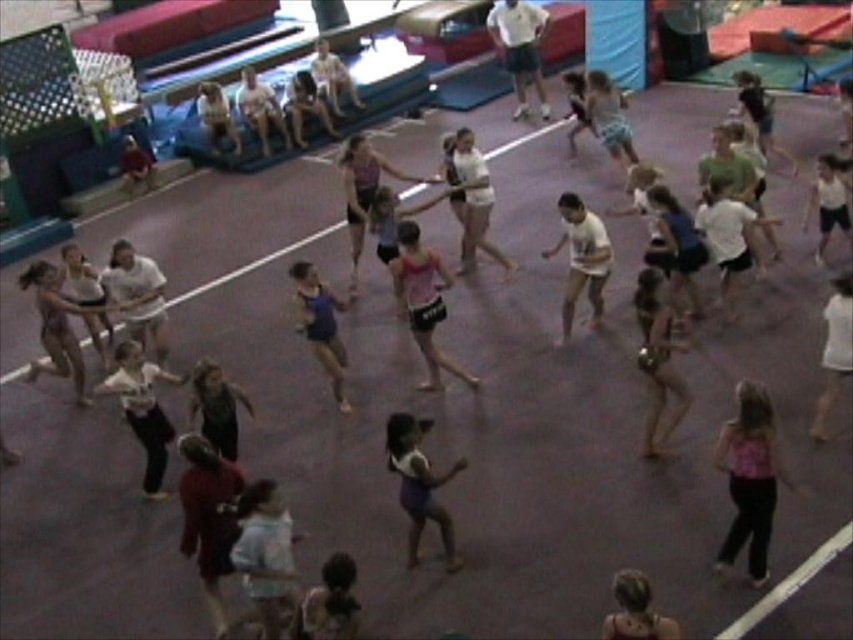
Can you confirm if pink fabric top at lower right is positioned to the left of matte blue tank top at center?

In fact, pink fabric top at lower right is to the right of matte blue tank top at center.

Who is more distant from viewer, (758,483) or (310,278)?

The point (310,278) is behind.

Where is `pink fabric top at lower right`? This screenshot has height=640, width=853. pink fabric top at lower right is located at coordinates (750, 477).

Between light blue fabric at center and white matte shirt at center, which one is positioned lower?

light blue fabric at center

From the picture: Does light blue fabric at center appear under white matte shirt at center?

Correct, light blue fabric at center is located below white matte shirt at center.

Between point (279, 515) and point (590, 212), which one is positioned in front?

Positioned in front is point (279, 515).

In order to click on light blue fabric at center in this screenshot , I will do `click(265, 554)`.

Between white matte shirt at center and matte blue tank top at center, which one is positioned lower?

matte blue tank top at center is below.

Is white matte shirt at center to the right of matte blue tank top at center from the viewer's perspective?

Yes, white matte shirt at center is to the right of matte blue tank top at center.

Who is more distant from viewer, (570, 333) or (309, 278)?

The point (570, 333) is behind.

In order to click on white matte shirt at center in this screenshot , I will do `click(581, 259)`.